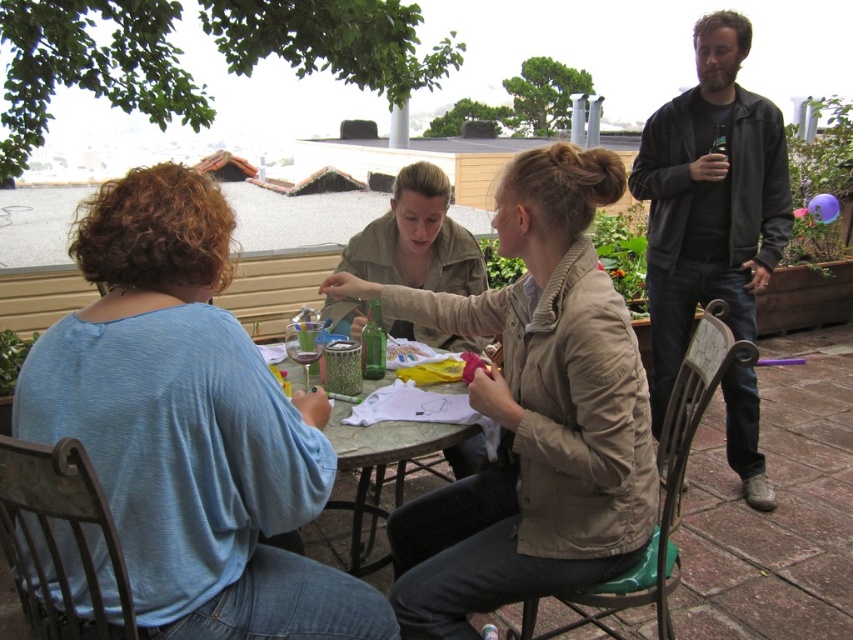
You are a photographer taking a picture of the light blue jersey at left and the khaki cotton jacket at center. Which clothing item should you focus on first if you want to capture both in the same frame without moving the camera?

The light blue jersey at left is much taller than the khaki cotton jacket at center, so you should focus on the light blue jersey at left first to ensure it is in frame and properly composed.

You are organizing a charity event and need to display two items on a narrow shelf. The light blue jersey at left and the khaki cotton jacket at center are available. Which item should you choose to fit better on the shelf if the shelf can only accommodate the narrower item?

The khaki cotton jacket at center should be chosen because the light blue jersey at left is wider than the khaki cotton jacket at center, making the jacket narrower and thus better suited for the narrow shelf.